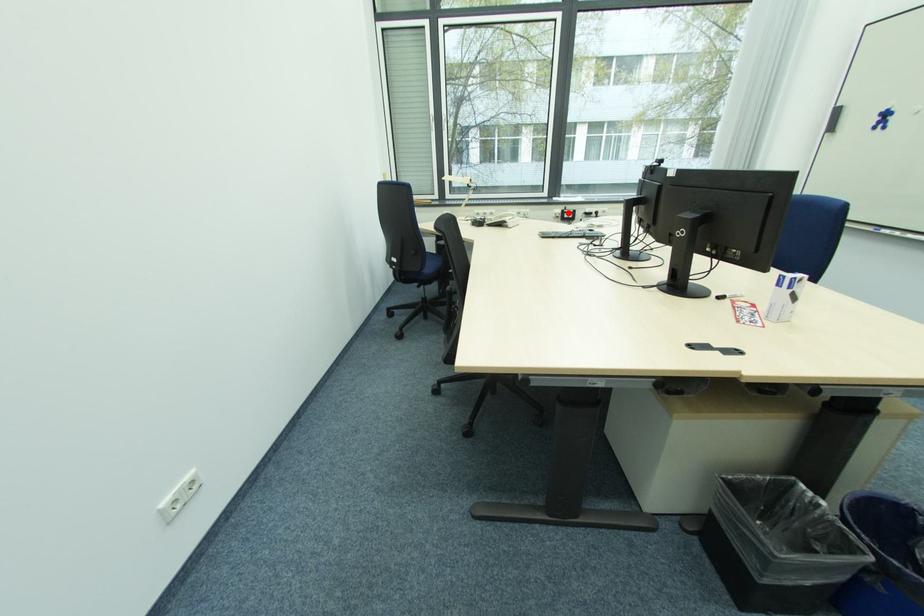
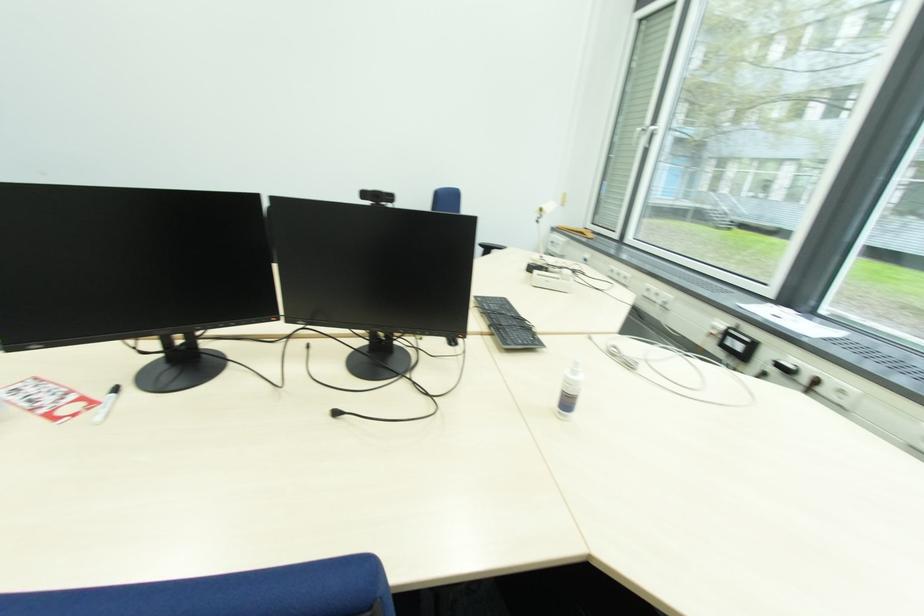
Find the pixel in the second image that matches the highlighted location in the first image.

(734, 333)